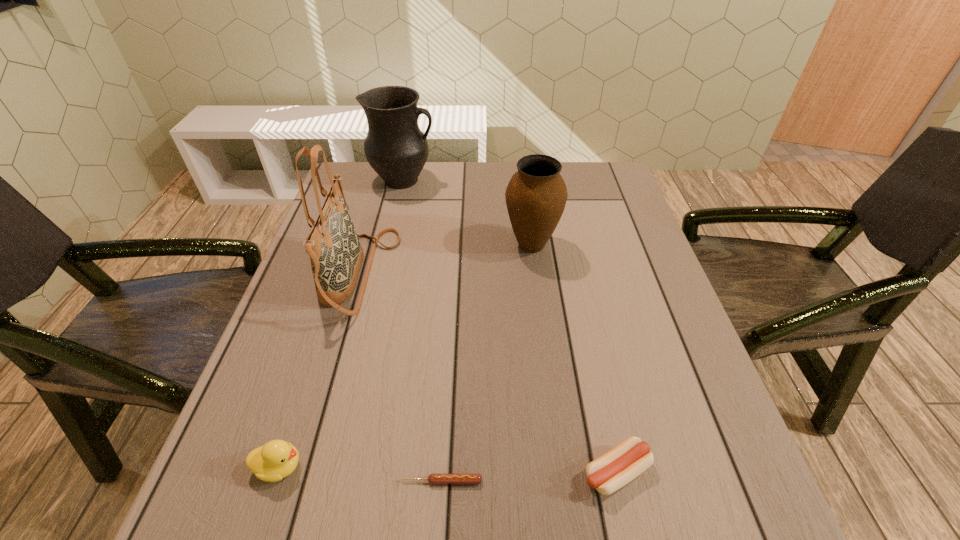
The image size is (960, 540). I want to click on object located in the far left corner section of the desktop, so click(395, 147).

This screenshot has height=540, width=960. Identify the location of object that is at the near right corner. (616, 468).

This screenshot has height=540, width=960. Identify the location of vacant region at the far edge of the desktop. (445, 165).

Find the location of a particular element. This screenshot has height=540, width=960. vacant point at the near edge is located at coordinates (340, 500).

At what (x,y) coordinates should I click in order to perform the action: click on free spot at the left edge of the desktop. Please return your answer as a coordinate pair (x, y). This screenshot has width=960, height=540. Looking at the image, I should click on (273, 435).

Image resolution: width=960 pixels, height=540 pixels. I want to click on free point at the right edge, so click(x=630, y=399).

Image resolution: width=960 pixels, height=540 pixels. In order to click on vacant region at the far left corner in this screenshot , I will do `click(366, 197)`.

At what (x,y) coordinates should I click in order to perform the action: click on vacant space that's between the fourth tallest object and the tallest object. Please return your answer as a coordinate pair (x, y). Looking at the image, I should click on (319, 370).

At what (x,y) coordinates should I click in order to perform the action: click on free area in between the urn and the shorter sausage. Please return your answer as a coordinate pair (x, y). This screenshot has height=540, width=960. Looking at the image, I should click on (487, 363).

At what (x,y) coordinates should I click in order to perform the action: click on unoccupied position between the pitcher and the duckling. Please return your answer as a coordinate pair (x, y). Looking at the image, I should click on (342, 323).